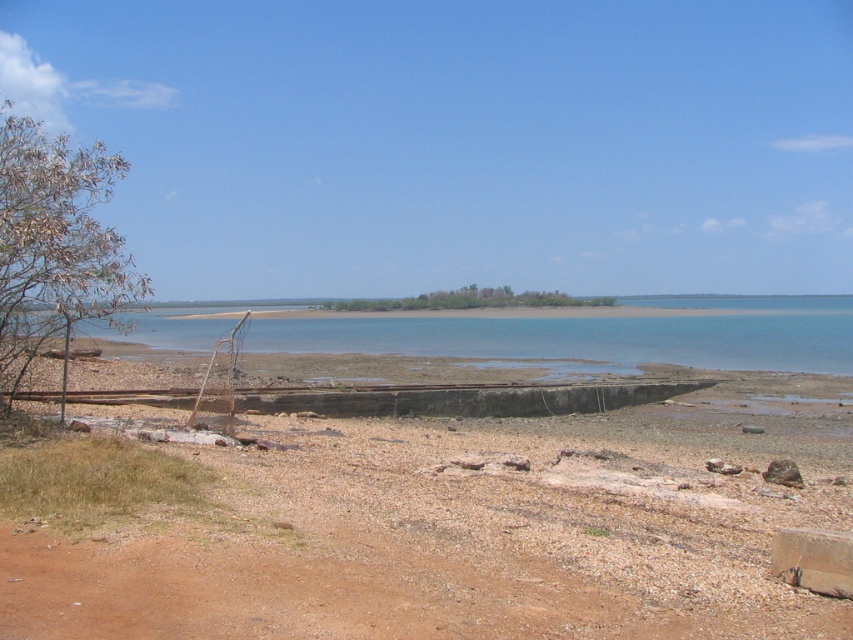
Question: Can you confirm if green leafy tree at left is positioned to the right of green leafy trees at center?

Choices:
 (A) yes
 (B) no

Answer: (B)

Question: Which of the following is the farthest from the observer?

Choices:
 (A) (490, 332)
 (B) (424, 433)
 (C) (76, 262)
 (D) (502, 285)

Answer: (D)

Question: Is brown gravelly sand at lower center behind green leafy trees at center?

Choices:
 (A) no
 (B) yes

Answer: (A)

Question: Which object is positioned farthest from the green leafy tree at left?

Choices:
 (A) blue water at center
 (B) brown gravelly sand at lower center

Answer: (A)

Question: Can you confirm if blue water at center is thinner than green leafy tree at left?

Choices:
 (A) yes
 (B) no

Answer: (B)

Question: Based on their relative distances, which object is farther from the green leafy tree at left?

Choices:
 (A) green leafy trees at center
 (B) brown gravelly sand at lower center

Answer: (A)